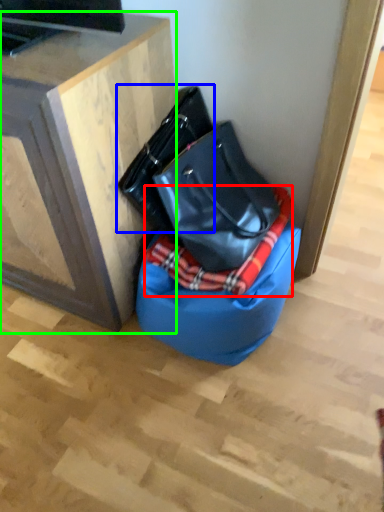
Question: Considering the real-world distances, which object is farthest from blanket (highlighted by a red box)? handbag (highlighted by a blue box) or furniture (highlighted by a green box)?

Choices:
 (A) handbag
 (B) furniture

Answer: (B)